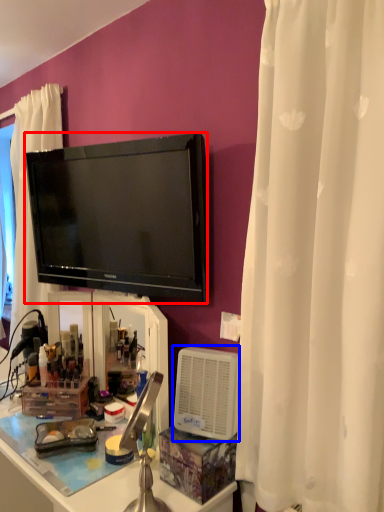
Question: Which point is further to the camera, television (highlighted by a red box) or appliance (highlighted by a blue box)?

Choices:
 (A) television
 (B) appliance

Answer: (A)